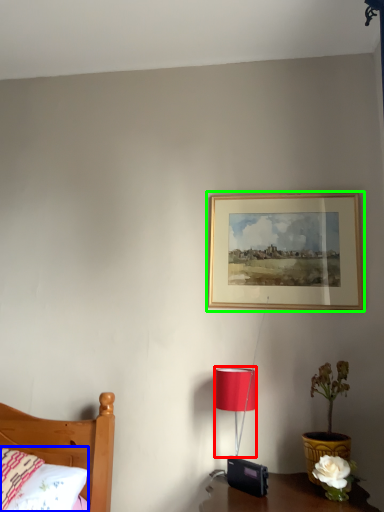
Question: Based on their relative distances, which object is nearer to lamp (highlighted by a red box)? Choose from pillow (highlighted by a blue box) and picture frame (highlighted by a green box).

Choices:
 (A) pillow
 (B) picture frame

Answer: (B)